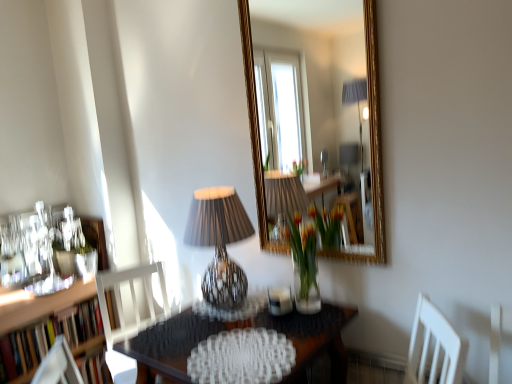
Question: In terms of width, does wooden table at center look wider or thinner when compared to wooden bookshelf at left?

Choices:
 (A) wide
 (B) thin

Answer: (A)

Question: Is wooden table at center situated inside wooden bookshelf at left or outside?

Choices:
 (A) inside
 (B) outside

Answer: (B)

Question: Which of these objects is positioned closest to the wooden bookshelf at left?

Choices:
 (A) wooden table at center
 (B) translucent glass vase at center
 (C) white wood chair at lower left
 (D) matte black lampshade at center
 (E) matte black picture frame at left

Answer: (C)

Question: Which is farther from the wooden table at center?

Choices:
 (A) wooden bookshelf at left
 (B) matte black lampshade at center
 (C) white wood chair at lower left
 (D) translucent glass vase at center
 (E) matte black picture frame at left

Answer: (E)